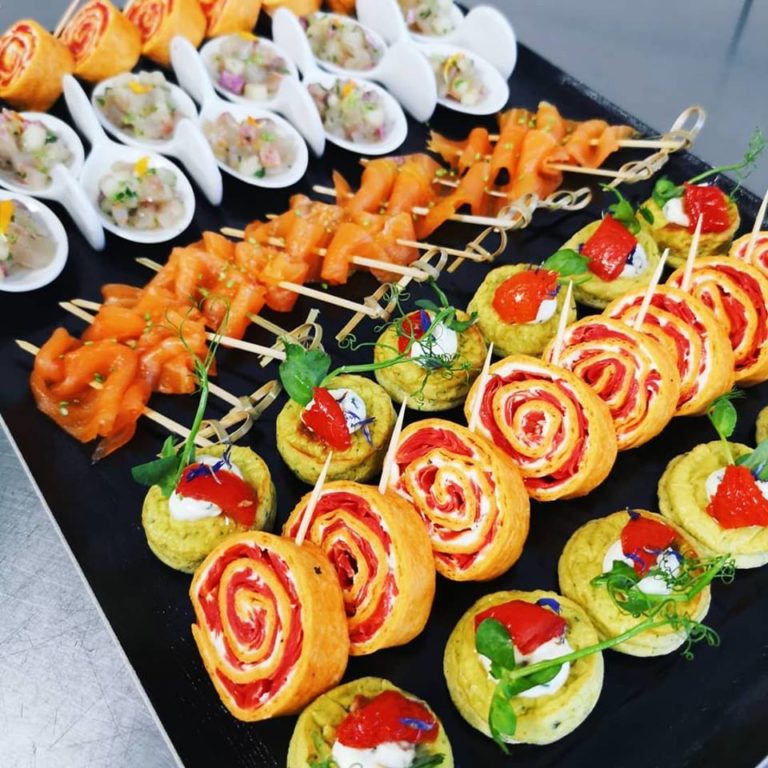
The width and height of the screenshot is (768, 768). Identify the location of dark streak in white countertop. (743, 21).